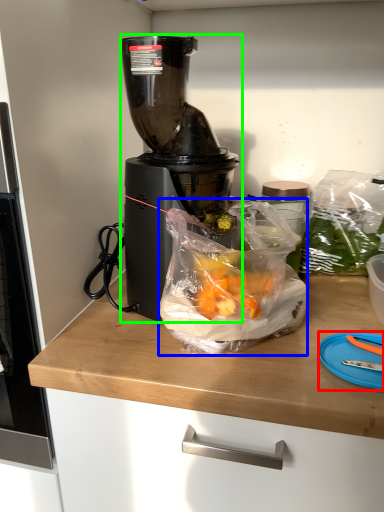
Question: Based on their relative distances, which object is nearer to cutting board (highlighted by a red box)? Choose from waste (highlighted by a blue box) and blender (highlighted by a green box).

Choices:
 (A) waste
 (B) blender

Answer: (A)